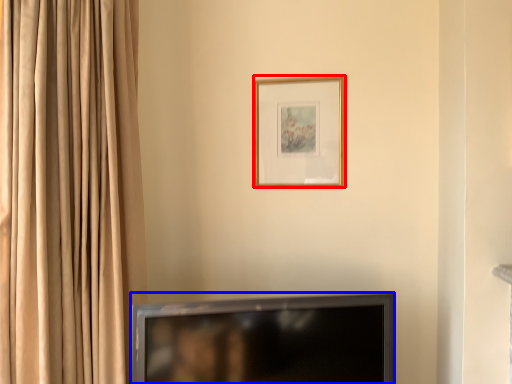
Question: Which of the following is the farthest to the observer, picture frame (highlighted by a red box) or television (highlighted by a blue box)?

Choices:
 (A) picture frame
 (B) television

Answer: (A)